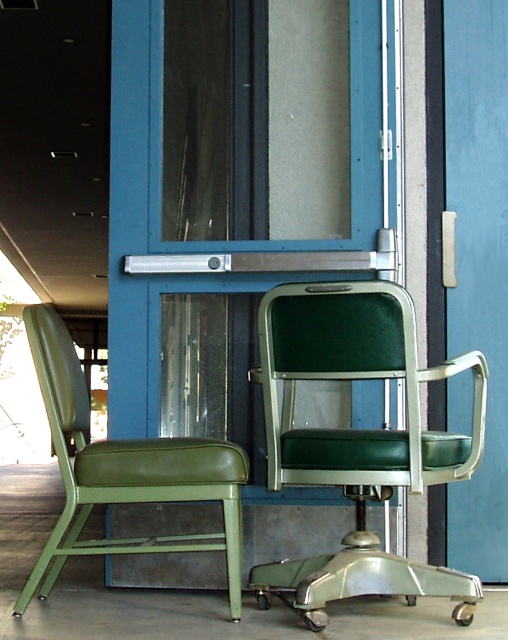
Is point (386, 355) positioned in front of point (234, 582)?

Yes, point (386, 355) is in front of point (234, 582).

Looking at this image, between green leather swivel chair at center and green leather chair at left, which one has less height?

With less height is green leather chair at left.

This screenshot has width=508, height=640. Identify the location of green leather swivel chair at center. (358, 440).

You are a GUI agent. You are given a task and a screenshot of the screen. Output one action in this format:
    pyautogui.click(x=<x>, y=<y>)
    Task: Click on the green leather swivel chair at center
    
    Given the screenshot: What is the action you would take?
    pyautogui.click(x=358, y=440)